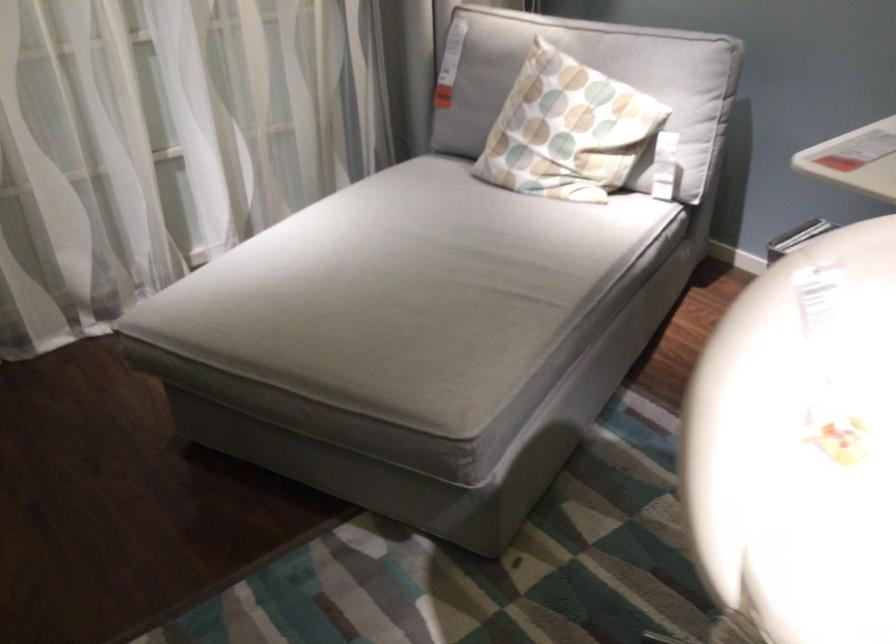
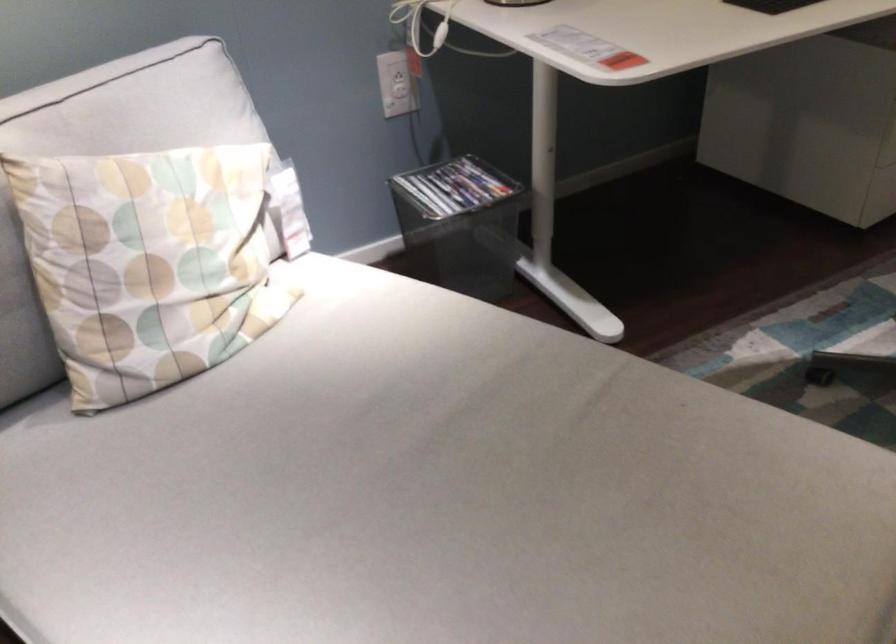
In the second image, find the point that corresponds to [429,263] in the first image.

(438, 495)